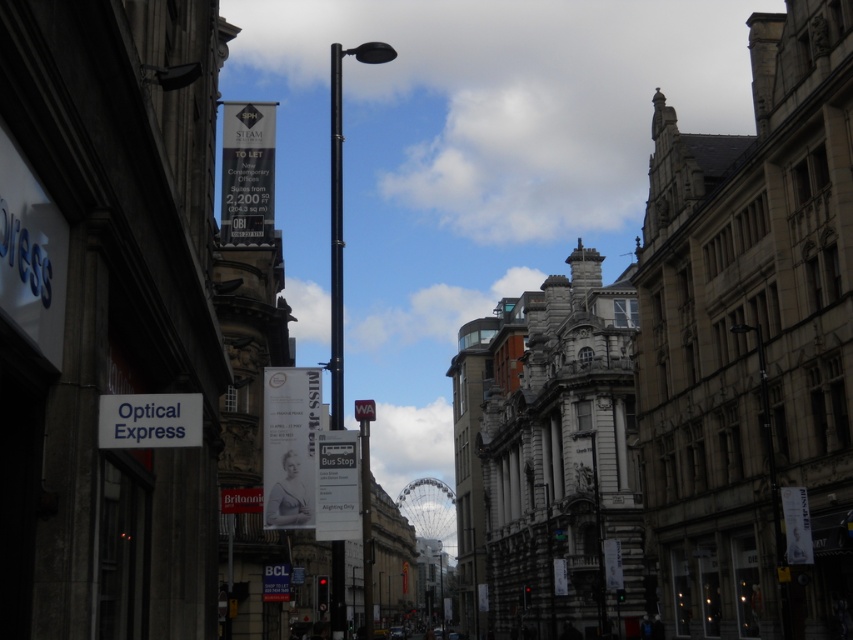
Does black metal lamp post at center have a smaller size compared to white paper sign at lower center?

Actually, black metal lamp post at center might be larger than white paper sign at lower center.

Which is above, black metal lamp post at center or white paper sign at lower center?

black metal lamp post at center is higher up.

In order to click on black metal lamp post at center in this screenshot , I will do `click(341, 212)`.

The image size is (853, 640). Find the location of `black metal lamp post at center`. black metal lamp post at center is located at coordinates (341, 212).

What do you see at coordinates (335, 241) in the screenshot? I see `black metal pole at center` at bounding box center [335, 241].

Is black metal pole at center shorter than white plastic street sign at center?

No, black metal pole at center is not shorter than white plastic street sign at center.

Locate an element on the screen. The width and height of the screenshot is (853, 640). black metal pole at center is located at coordinates click(x=335, y=241).

Is white matte sign at lower left shorter than white paper sign at lower center?

Yes.

Does white matte sign at lower left have a lesser width compared to white paper sign at lower center?

Correct, white matte sign at lower left's width is less than white paper sign at lower center's.

Find the location of a particular element. white matte sign at lower left is located at coordinates (149, 420).